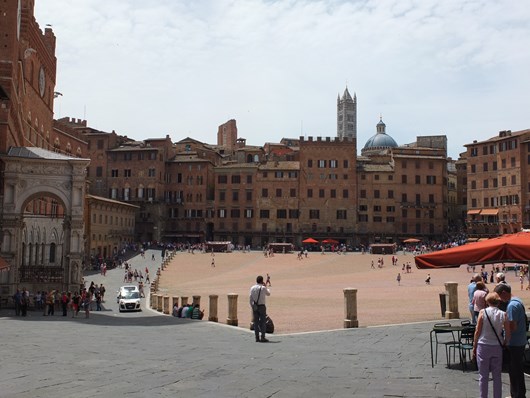
I want to click on archway, so click(43, 180).